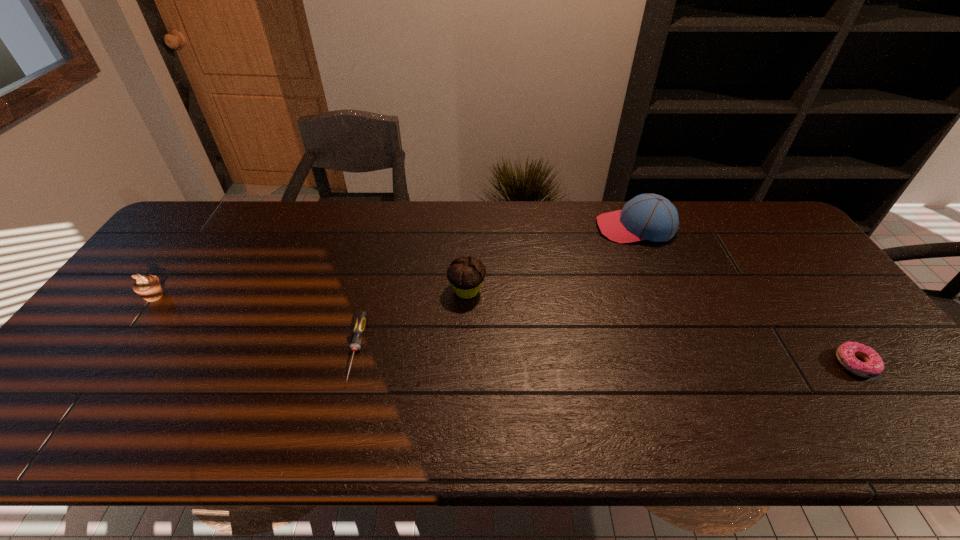
Identify the location of vacant area in the image that satisfies the following two spatial constraints: 1. on the front-facing side of the second object from right to left; 2. insert the screwdriver into a screw head. (685, 350).